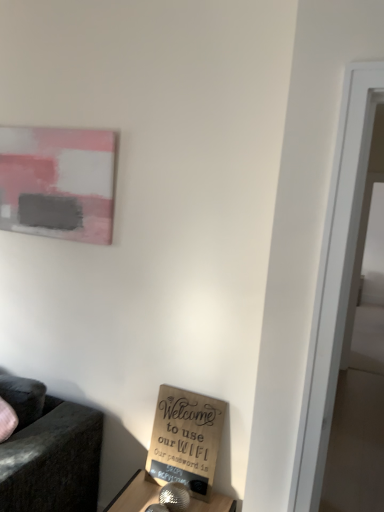
Question: Considering their positions, is burlap sign at lower center located in front of or behind matte pink painting at upper left?

Choices:
 (A) behind
 (B) front

Answer: (B)

Question: From the image's perspective, is burlap sign at lower center located above or below matte pink painting at upper left?

Choices:
 (A) below
 (B) above

Answer: (A)

Question: Considering the relative positions of burlap sign at lower center and matte pink painting at upper left in the image provided, is burlap sign at lower center to the left or to the right of matte pink painting at upper left?

Choices:
 (A) left
 (B) right

Answer: (B)

Question: Relative to burlap sign at lower center, is matte pink painting at upper left in front or behind?

Choices:
 (A) front
 (B) behind

Answer: (B)

Question: Would you say matte pink painting at upper left is to the left or to the right of burlap sign at lower center in the picture?

Choices:
 (A) left
 (B) right

Answer: (A)

Question: From a real-world perspective, is matte pink painting at upper left physically located above or below burlap sign at lower center?

Choices:
 (A) below
 (B) above

Answer: (B)

Question: Does point (51, 128) appear closer or farther from the camera than point (162, 395)?

Choices:
 (A) closer
 (B) farther

Answer: (B)